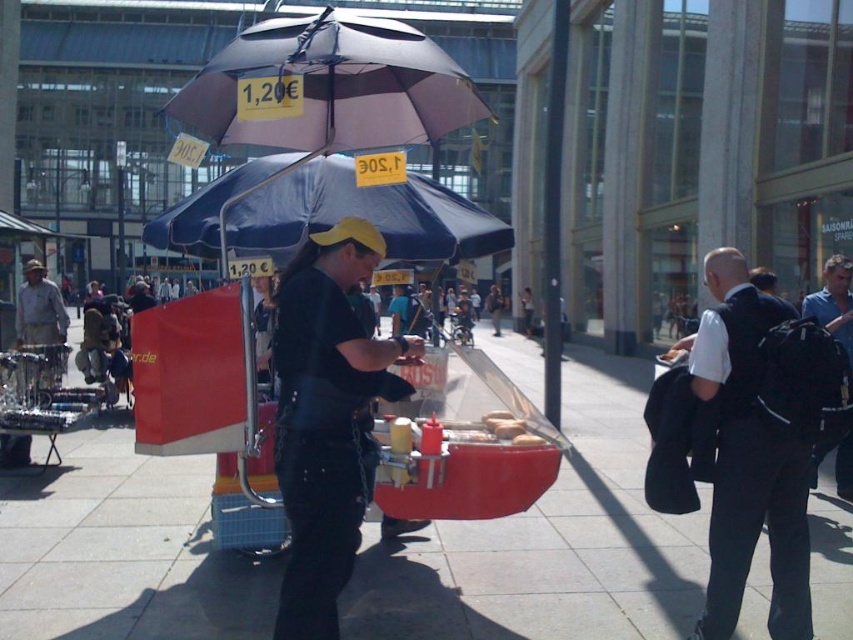
You are a customer trying to reach the hot dog vendor. You notice a black leather jacket at center and a blue fabric umbrella at center. Which item is narrower?

The black leather jacket at center is narrower than the blue fabric umbrella at center.

You are a pedestrian trying to stay dry during a sudden rain shower. You see the matte black umbrella at upper center and the blue fabric umbrella at center. Which one offers more coverage if you need to shelter under it?

The matte black umbrella at upper center might be wider than blue fabric umbrella at center, so it likely offers more coverage for sheltering during the rain.